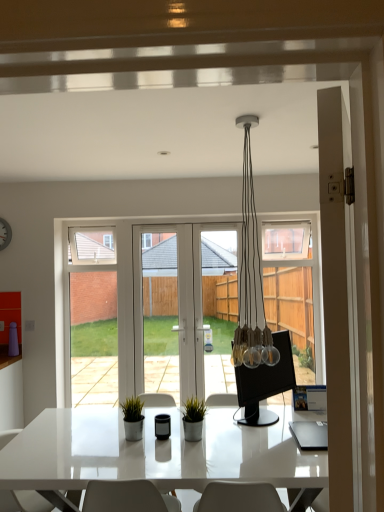
Question: Is green matte plant at center taller than white glossy screen door at center, the 1th screen door in the right-to-left sequence?

Choices:
 (A) no
 (B) yes

Answer: (A)

Question: Is green matte plant at center next to white glossy screen door at center, the 1th screen door in the right-to-left sequence?

Choices:
 (A) no
 (B) yes

Answer: (A)

Question: Is green matte plant at center to the right of white glossy screen door at center, positioned as the 3th screen door in left-to-right order, from the viewer's perspective?

Choices:
 (A) yes
 (B) no

Answer: (B)

Question: Is green matte plant at center outside of white glossy screen door at center, the 1th screen door in the right-to-left sequence?

Choices:
 (A) no
 (B) yes

Answer: (B)

Question: Is green matte plant at center looking in the opposite direction of white glossy screen door at center, positioned as the 3th screen door in left-to-right order?

Choices:
 (A) no
 (B) yes

Answer: (B)

Question: Relative to white glossy screen door at center, the 1th screen door in the right-to-left sequence, is white matte clock at upper left in front or behind?

Choices:
 (A) behind
 (B) front

Answer: (B)

Question: From a real-world perspective, is white matte clock at upper left above or below white glossy screen door at center, positioned as the 3th screen door in left-to-right order?

Choices:
 (A) above
 (B) below

Answer: (A)

Question: Is white matte clock at upper left inside the boundaries of white glossy screen door at center, positioned as the 3th screen door in left-to-right order, or outside?

Choices:
 (A) outside
 (B) inside

Answer: (A)

Question: Is white matte clock at upper left wider or thinner than white glossy screen door at center, the 1th screen door in the right-to-left sequence?

Choices:
 (A) wide
 (B) thin

Answer: (B)

Question: In the image, is white glossy chair at lower left on the left side or the right side of green matte plant at center?

Choices:
 (A) right
 (B) left

Answer: (B)

Question: From a real-world perspective, relative to green matte plant at center, is white glossy chair at lower left vertically above or below?

Choices:
 (A) above
 (B) below

Answer: (B)

Question: In the image, is white glossy chair at lower left positioned in front of or behind green matte plant at center?

Choices:
 (A) behind
 (B) front

Answer: (B)

Question: From the image's perspective, is white glossy chair at lower left positioned above or below green matte plant at center?

Choices:
 (A) above
 (B) below

Answer: (B)

Question: Considering the positions of clear glass door at center, the second screen door in the right-to-left sequence, and white glass screen door at left, the first screen door viewed from the left, in the image, is clear glass door at center, the second screen door in the right-to-left sequence, wider or thinner than white glass screen door at left, the first screen door viewed from the left,?

Choices:
 (A) thin
 (B) wide

Answer: (A)

Question: Is clear glass door at center, the second screen door in the right-to-left sequence, in front of or behind white glass screen door at left, which appears as the third screen door when viewed from the right, in the image?

Choices:
 (A) front
 (B) behind

Answer: (A)